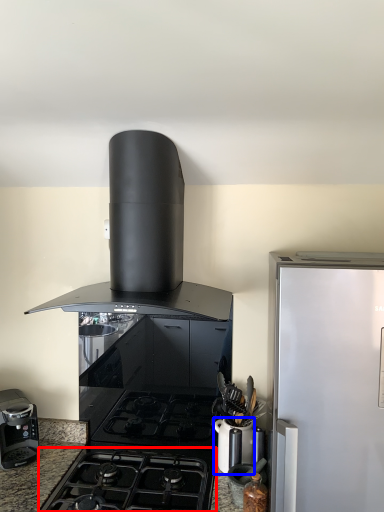
Question: Which of the following is the closest to the observer, gas stove (highlighted by a red box) or kitchen appliance (highlighted by a blue box)?

Choices:
 (A) gas stove
 (B) kitchen appliance

Answer: (A)